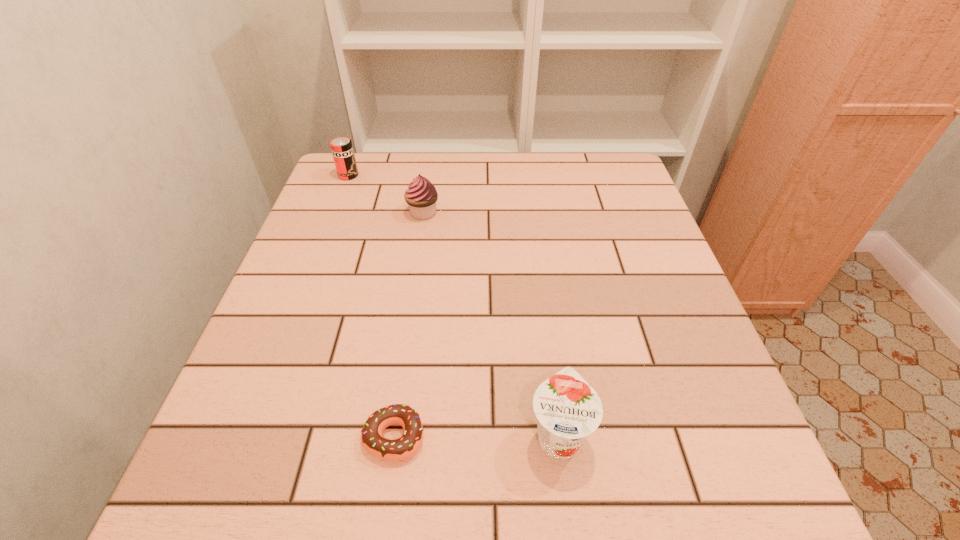
Identify the location of the second farthest object. (421, 196).

Find the location of a particular element. This screenshot has width=960, height=540. the leftmost object is located at coordinates (342, 150).

Identify the location of can. This screenshot has width=960, height=540. (342, 150).

You are a GUI agent. You are given a task and a screenshot of the screen. Output one action in this format:
    pyautogui.click(x=<x>, y=<y>)
    Task: Click on the rightmost object
    The image size is (960, 540).
    Given the screenshot: What is the action you would take?
    pyautogui.click(x=568, y=409)

Locate an element on the screen. The height and width of the screenshot is (540, 960). the shortest object is located at coordinates (372, 440).

Locate an element on the screen. free space located on the back of the cupcake is located at coordinates (427, 186).

Locate an element on the screen. The image size is (960, 540). vacant space located on the right of the leftmost object is located at coordinates (447, 175).

Where is `free region located 0.200m on the left of the rightmost object`? The image size is (960, 540). free region located 0.200m on the left of the rightmost object is located at coordinates (401, 435).

The image size is (960, 540). Find the location of `free region located on the left of the doughnut`. free region located on the left of the doughnut is located at coordinates (294, 437).

In order to click on object present at the far edge in this screenshot , I will do `click(342, 150)`.